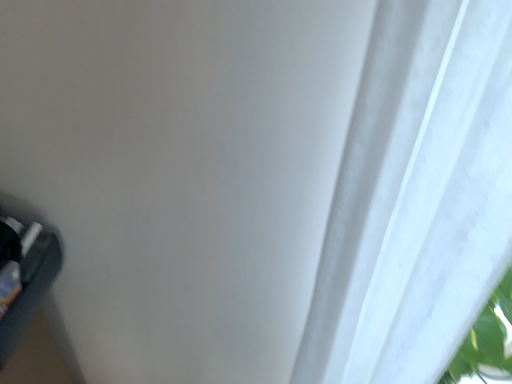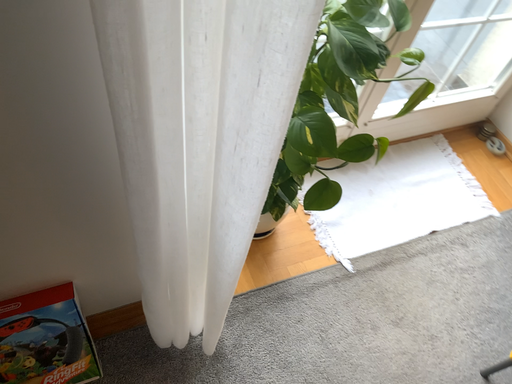
Question: How did the camera likely rotate when shooting the video?

Choices:
 (A) rotated upward
 (B) rotated downward

Answer: (B)